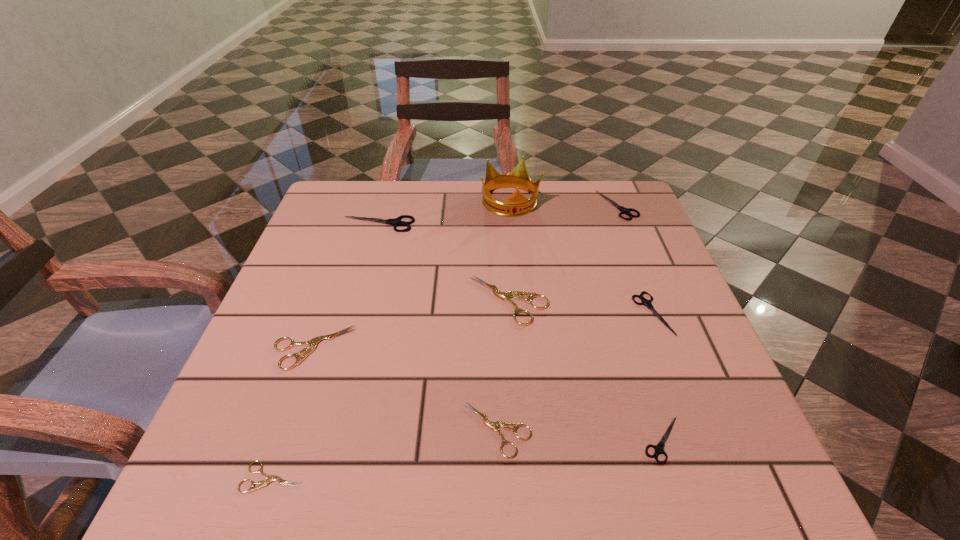
I want to click on crown, so click(x=516, y=204).

Image resolution: width=960 pixels, height=540 pixels. Find the location of `the tallest object`. the tallest object is located at coordinates (516, 204).

Locate an element on the screen. The height and width of the screenshot is (540, 960). the leftmost black shears is located at coordinates (395, 222).

At what (x,y) coordinates should I click in order to perform the action: click on the second tallest object. Please return your answer as a coordinate pair (x, y). Looking at the image, I should click on (395, 222).

Locate an element on the screen. the second biggest black shears is located at coordinates (623, 210).

The height and width of the screenshot is (540, 960). Identify the location of the biggest beige shears. (505, 296).

This screenshot has height=540, width=960. Identify the location of the third biggest black shears. (644, 301).

Where is `the third nearest beige shears`? Image resolution: width=960 pixels, height=540 pixels. the third nearest beige shears is located at coordinates (312, 343).

The height and width of the screenshot is (540, 960). In order to click on the third farthest beige shears in this screenshot , I will do `click(494, 426)`.

In order to click on the nearest black shears in this screenshot , I will do `click(659, 448)`.